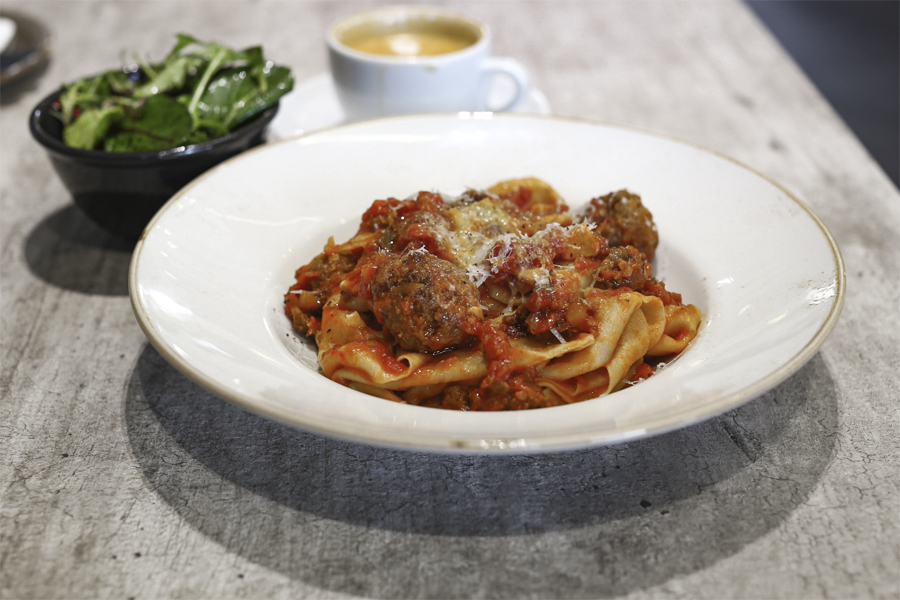
In order to click on plate in this screenshot , I will do `click(230, 284)`.